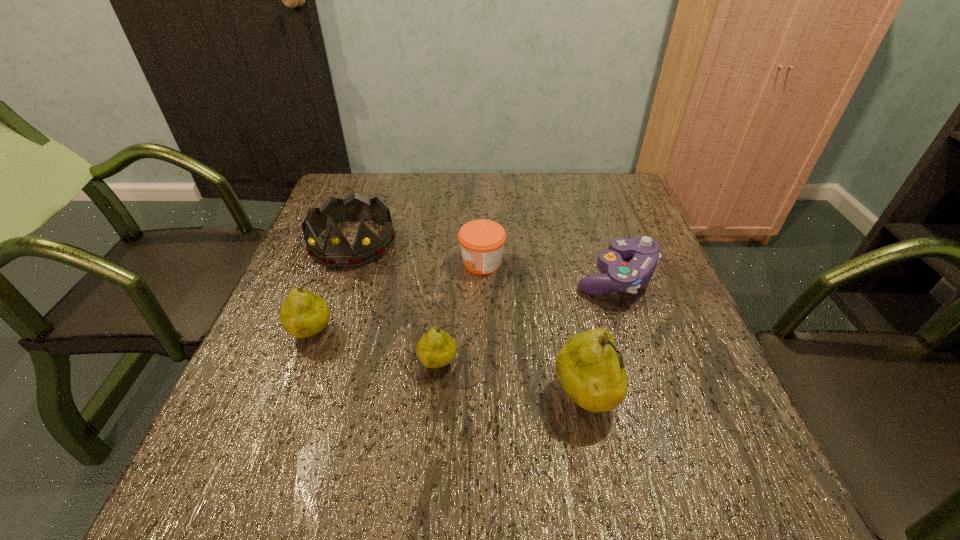
The height and width of the screenshot is (540, 960). Identify the location of free spot between the leftmost pear and the tiara. (332, 288).

What are the coordinates of `blank region between the jam and the shortest pear` in the screenshot? It's located at (461, 313).

What are the coordinates of `free spot between the tiara and the jam` in the screenshot? It's located at (418, 253).

Identify which object is located as the fourth nearest to the control. Please provide its 2D coordinates. Your answer should be formatted as a tuple, i.e. [(x, y)], where the tuple contains the x and y coordinates of a point satisfying the conditions above.

[(337, 252)]

Locate an element on the screen. the fifth closest object to the fifth shortest object is located at coordinates (590, 369).

Locate which pear ranks in proximity to the control. Please provide its 2D coordinates. Your answer should be formatted as a tuple, i.e. [(x, y)], where the tuple contains the x and y coordinates of a point satisfying the conditions above.

[(590, 369)]

Locate which pear is the third closest to the control. Please provide its 2D coordinates. Your answer should be formatted as a tuple, i.e. [(x, y)], where the tuple contains the x and y coordinates of a point satisfying the conditions above.

[(304, 313)]

Where is `vacant region that satisfies the following two spatial constraints: 1. at the front of the fifth shortest object with jewels; 2. on the left side of the control`? vacant region that satisfies the following two spatial constraints: 1. at the front of the fifth shortest object with jewels; 2. on the left side of the control is located at coordinates (341, 276).

Identify the location of vacant space that satisfies the following two spatial constraints: 1. on the front side of the tallest pear; 2. on the left side of the second pear from left to right. This screenshot has height=540, width=960. click(x=437, y=399).

Locate an element on the screen. The height and width of the screenshot is (540, 960). vacant position in the image that satisfies the following two spatial constraints: 1. on the front label of the tallest pear; 2. on the right side of the jam is located at coordinates (483, 399).